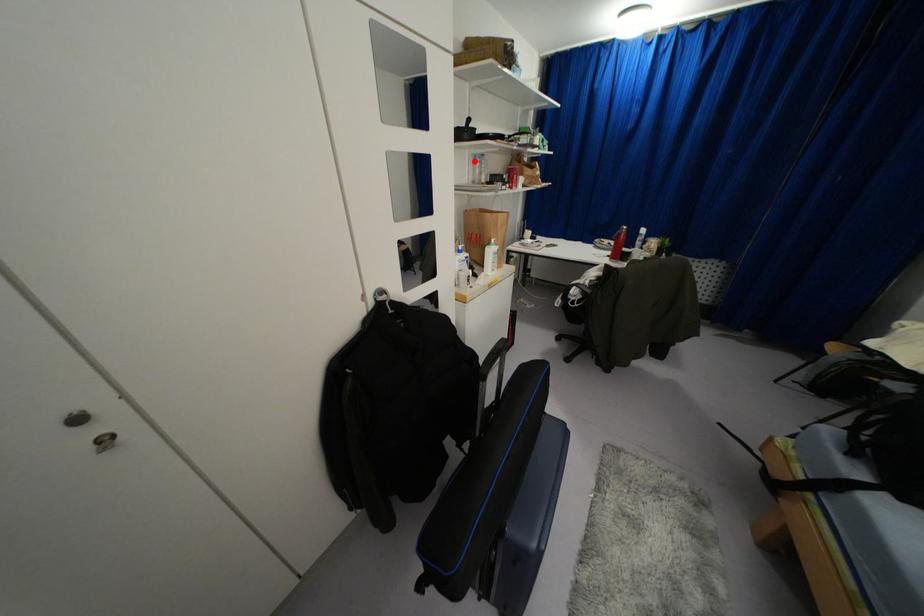
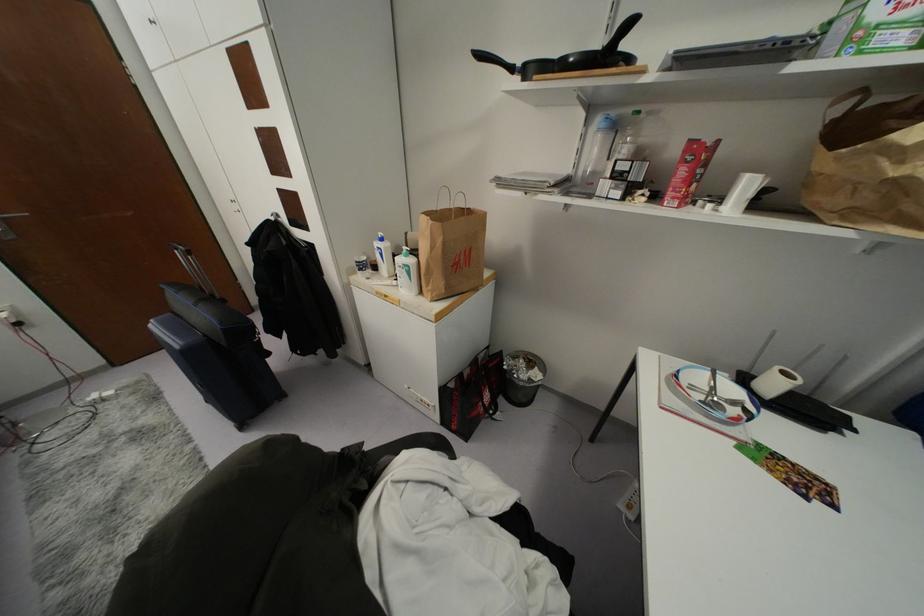
Question: I am providing you with two images of the same scene from different viewpoints. In image1, a red point is highlighted. Considering the same 3D point in image2, which of the following is correct?

Choices:
 (A) It is closer
 (B) It is farther

Answer: (B)